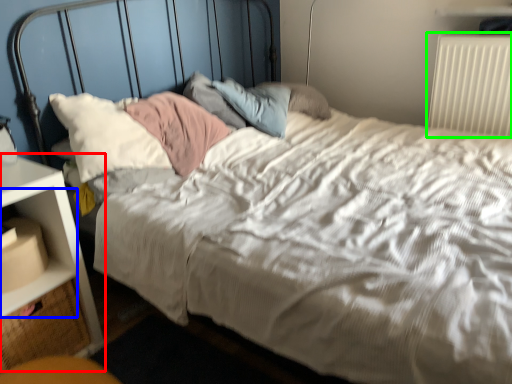
Question: Based on their relative distances, which object is nearer to nightstand (highlighted by a red box)? Choose from shelf (highlighted by a blue box) and radiator (highlighted by a green box).

Choices:
 (A) shelf
 (B) radiator

Answer: (A)